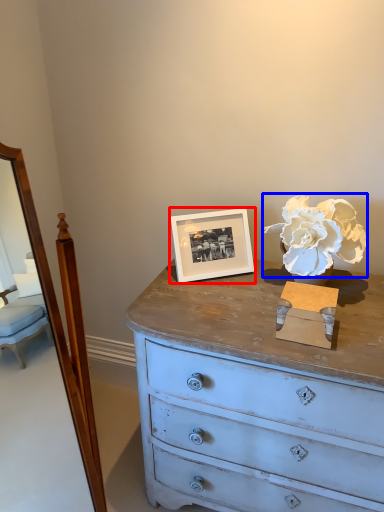
Question: Which object is further to the camera taking this photo, picture frame (highlighted by a red box) or flower (highlighted by a blue box)?

Choices:
 (A) picture frame
 (B) flower

Answer: (A)